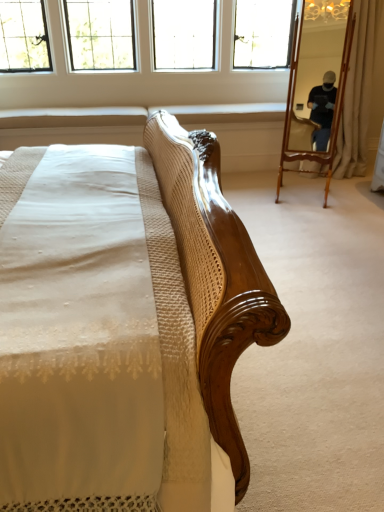
In order to face beige fabric curtain at right, should I rotate leftwards or rightwards?

Turn right approximately 21.703 degrees to face it.

Looking at this image, what is the approximate width of clear glass windows at upper center?

clear glass windows at upper center is 19.21 inches wide.

Where is `clear glass windows at upper center`? The image size is (384, 512). clear glass windows at upper center is located at coordinates (100, 34).

Image resolution: width=384 pixels, height=512 pixels. Identify the location of beige fabric curtain at right. (361, 90).

Between clear glass windows at upper center and wooden mirror at right, which one has larger width?

clear glass windows at upper center is wider.

Looking at this image, does clear glass windows at upper center have a smaller size compared to wooden mirror at right?

No.

Is wooden mirror at right a part of clear glass windows at upper center?

No, wooden mirror at right is not inside clear glass windows at upper center.

Considering the points (96, 44) and (314, 125), which point is behind, point (96, 44) or point (314, 125)?

The point (96, 44) is more distant.

From a real-world perspective, relative to clear glass windows at upper center, is beige fabric curtain at right vertically above or below?

beige fabric curtain at right is situated lower than clear glass windows at upper center in the real world.

Does point (382, 6) lie behind point (210, 37)?

No, (382, 6) is in front of (210, 37).

Is beige fabric curtain at right not close to clear glass windows at upper center?

Indeed, beige fabric curtain at right is not near clear glass windows at upper center.

Does beige fabric curtain at right have a lesser width compared to clear glass windows at upper center?

Indeed, beige fabric curtain at right has a lesser width compared to clear glass windows at upper center.

Is wooden mirror at right to the left or to the right of clear glass windows at upper center in the image?

Based on their positions, wooden mirror at right is located to the right of clear glass windows at upper center.

From the picture: From the image's perspective, between wooden mirror at right and clear glass windows at upper center, who is located below?

wooden mirror at right, from the image's perspective.

Is wooden mirror at right wider or thinner than clear glass windows at upper center?

wooden mirror at right is thinner than clear glass windows at upper center.

Which point is more distant from viewer, (320, 28) or (181, 28)?

The point (181, 28) is farther from the camera.

Does clear glass windows at upper center touch beige fabric curtain at right?

No.

This screenshot has width=384, height=512. Find the location of `window above the beige fabric curtain at right (from the image's perspective)`. window above the beige fabric curtain at right (from the image's perspective) is located at coordinates (100, 34).

From a real-world perspective, who is located lower, clear glass windows at upper center or beige fabric curtain at right?

beige fabric curtain at right, from a real-world perspective.

Which is in front, beige fabric curtain at right or wooden mirror at right?

wooden mirror at right is more forward.

Which is more to the left, beige fabric curtain at right or wooden mirror at right?

wooden mirror at right.

Is beige fabric curtain at right oriented towards wooden mirror at right?

No, beige fabric curtain at right is not facing towards wooden mirror at right.

Would you say wooden mirror at right is part of beige fabric curtain at right's contents?

No, wooden mirror at right is not inside beige fabric curtain at right.

From a real-world perspective, is wooden mirror at right below beige fabric curtain at right?

Yes.

From the picture: Can you confirm if wooden mirror at right is shorter than beige fabric curtain at right?

Yes.

From the image's perspective, is wooden mirror at right located above or below beige fabric curtain at right?

wooden mirror at right is situated lower than beige fabric curtain at right in the image.

Would you say wooden mirror at right is outside beige fabric curtain at right?

Indeed, wooden mirror at right is completely outside beige fabric curtain at right.

At what (x,y) coordinates should I click in order to perform the action: click on window behind the wooden mirror at right. Please return your answer as a coordinate pair (x, y). Looking at the image, I should click on (100, 34).

At what (x,y) coordinates should I click in order to perform the action: click on window above the beige fabric curtain at right (from the image's perspective). Please return your answer as a coordinate pair (x, y). The width and height of the screenshot is (384, 512). Looking at the image, I should click on [100, 34].

Considering their positions, is wooden mirror at right positioned further to beige fabric curtain at right than clear glass windows at upper center?

clear glass windows at upper center is further to beige fabric curtain at right.

Based on their spatial positions, is clear glass windows at upper center or beige fabric curtain at right closer to wooden mirror at right?

The object closer to wooden mirror at right is beige fabric curtain at right.

From the image, which object appears to be nearer to clear glass windows at upper center, beige fabric curtain at right or wooden mirror at right?

wooden mirror at right lies closer to clear glass windows at upper center than the other object.

Looking at this image, based on their spatial positions, is clear glass windows at upper center or wooden mirror at right further from beige fabric curtain at right?

Based on the image, clear glass windows at upper center appears to be further to beige fabric curtain at right.

Based on their spatial positions, is wooden mirror at right or beige fabric curtain at right further from clear glass windows at upper center?

beige fabric curtain at right is positioned further to the anchor clear glass windows at upper center.

Consider the image. Considering their positions, is beige fabric curtain at right positioned closer to wooden mirror at right than clear glass windows at upper center?

beige fabric curtain at right is closer to wooden mirror at right.

Locate an element on the screen. This screenshot has width=384, height=512. mirror located between clear glass windows at upper center and beige fabric curtain at right in the left-right direction is located at coordinates (318, 70).